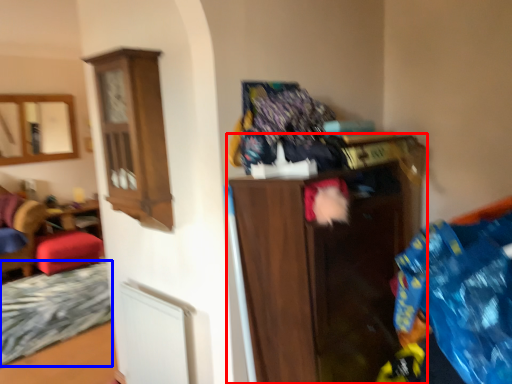
Question: Which object appears farthest to the camera in this image, shelf (highlighted by a red box) or bed frame (highlighted by a blue box)?

Choices:
 (A) shelf
 (B) bed frame

Answer: (B)